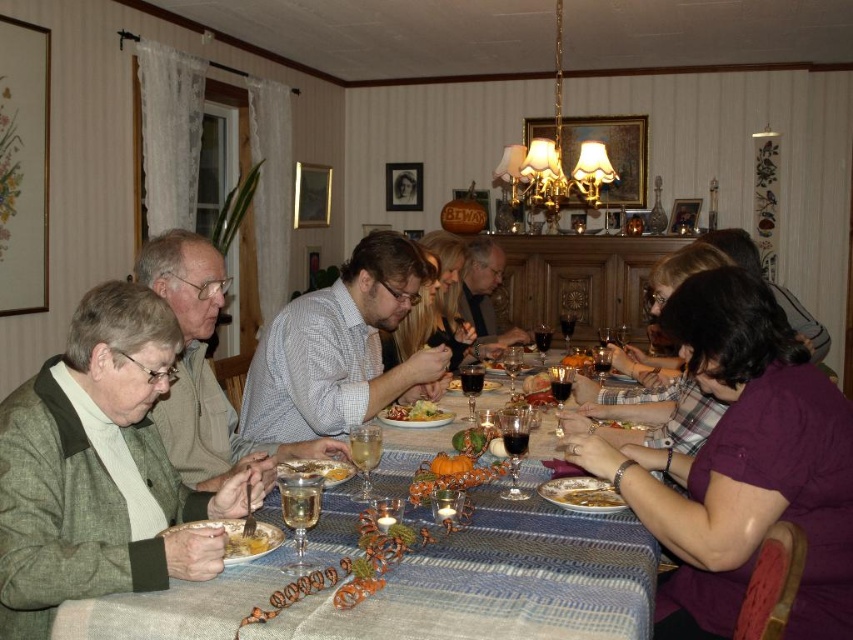
You are standing at the entrance of the dining room and want to greet the person wearing the matte gray shirt at center. In which direction should you walk to reach them?

The matte gray shirt at center is located at the center of the dining table, so you should walk straight ahead towards the center of the table to reach them.

You are a guest at the dinner table and want to reach for the yellowish matte pasta at center without spilling your wine. Since the matte gray shirt at center is in the way, can you safely move your hand under it to get to the pasta?

The matte gray shirt at center is located above the yellowish matte pasta at center, so you can safely move your hand under the shirt to reach the pasta without disturbing it.

You are a guest at the dining table and want to reach for the yellowish matte pasta at center without touching the matte gray shirt at center. Which direction should you move your hand relative to the pasta?

You should move your hand to the left relative to the yellowish matte pasta at center because the matte gray shirt at center is located to its right, so moving left would avoid contact with the shirt.